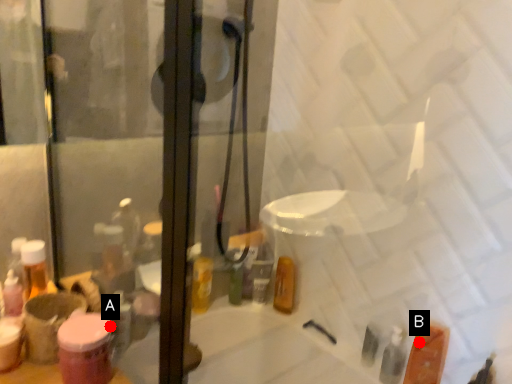
Question: Two points are circled on the image, labeled by A and B beside each circle. Which point is closer to the camera taking this photo?

Choices:
 (A) A is closer
 (B) B is closer

Answer: (A)